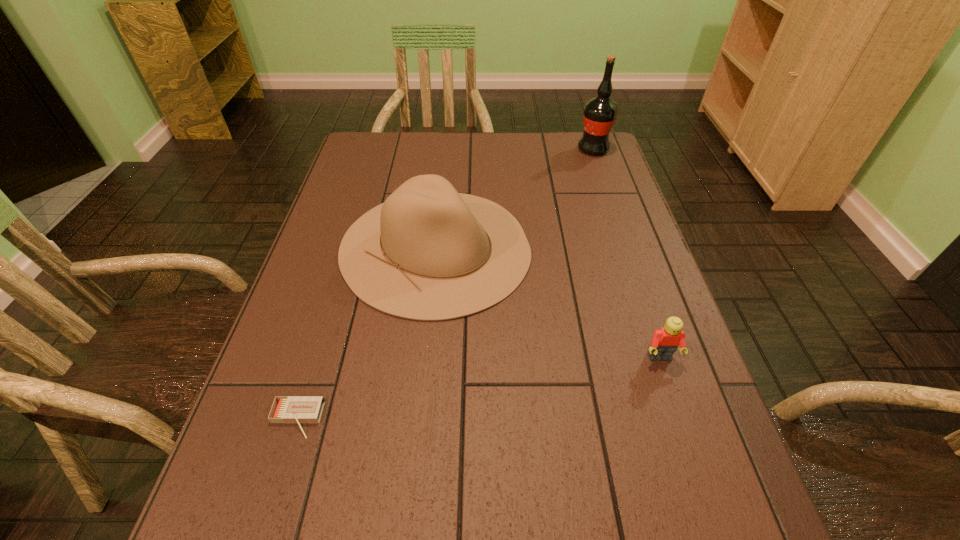
Locate an element on the screen. The image size is (960, 540). free space at the far left corner of the desktop is located at coordinates (390, 168).

Identify the location of vacant region at the far right corner of the desktop. This screenshot has height=540, width=960. (595, 172).

Identify the location of vacant point located between the third smallest yellow sunflower and the nearest yellow sunflower. The height and width of the screenshot is (540, 960). (590, 309).

Where is `vacant space that is in between the right green sunflower and the third biggest yellow sunflower`? vacant space that is in between the right green sunflower and the third biggest yellow sunflower is located at coordinates (487, 307).

Where is `free point between the left green sunflower and the biggest yellow sunflower`? This screenshot has height=540, width=960. free point between the left green sunflower and the biggest yellow sunflower is located at coordinates (466, 228).

The image size is (960, 540). Identify the location of vacant space that's between the bigger green sunflower and the nearest yellow sunflower. click(x=578, y=348).

Locate an element on the screen. The width and height of the screenshot is (960, 540). vacant space in between the third yellow sunflower from left to right and the biggest yellow sunflower is located at coordinates (478, 189).

Find the location of a particular element. This screenshot has width=960, height=540. empty space that is in between the left green sunflower and the rightmost yellow sunflower is located at coordinates (578, 348).

At what (x,y) coordinates should I click in order to perform the action: click on free spot between the shortest sunflower and the farther green sunflower. Please return your answer as a coordinate pair (x, y). This screenshot has height=540, width=960. Looking at the image, I should click on (578, 348).

The image size is (960, 540). I want to click on object that ranks as the closest to the biggest yellow sunflower, so pos(529,178).